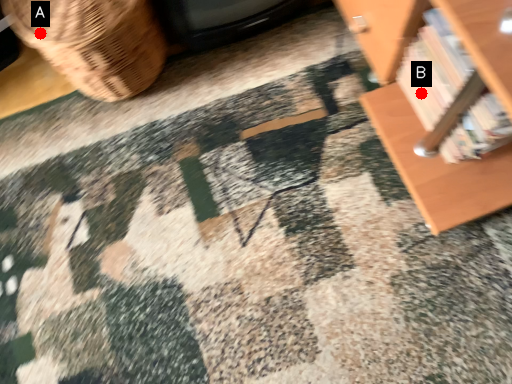
Question: Two points are circled on the image, labeled by A and B beside each circle. Which point is farther from the camera taking this photo?

Choices:
 (A) A is further
 (B) B is further

Answer: (B)